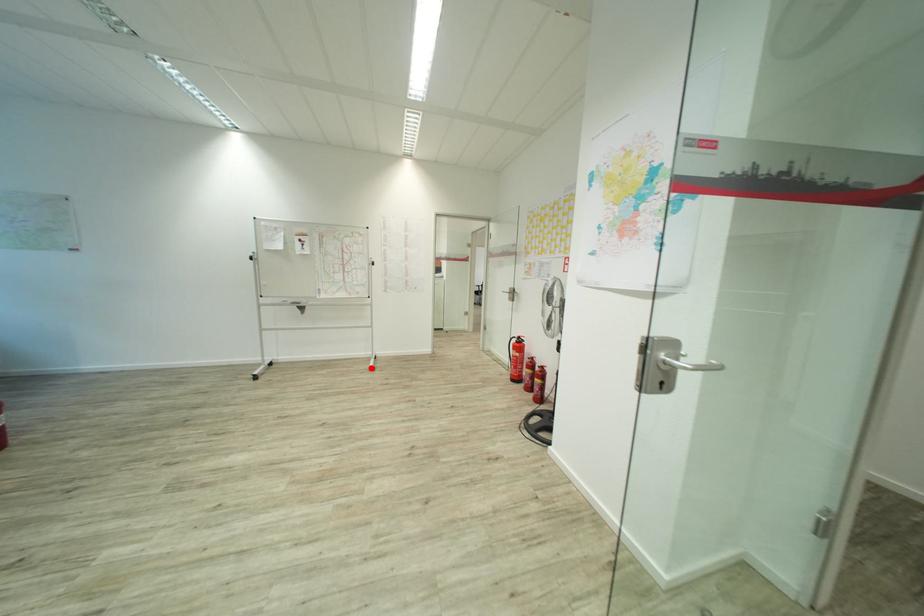
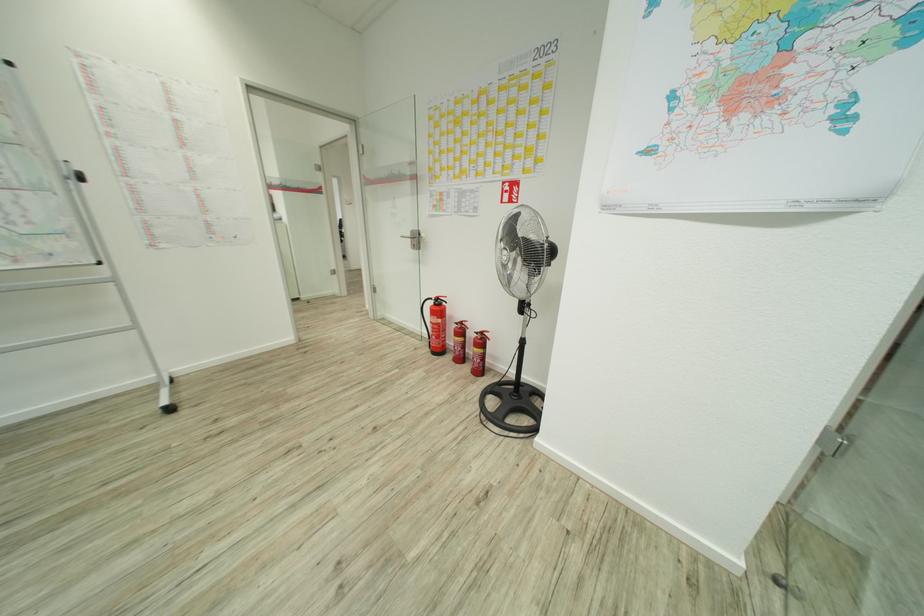
Find the pixel in the second image that matches the highlighted location in the first image.

(169, 408)